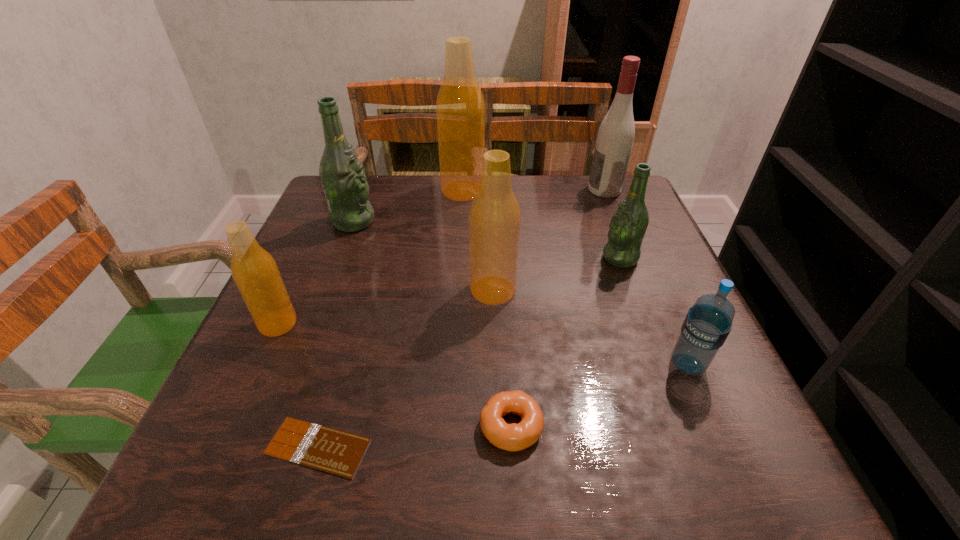
At what (x,y) coordinates should I click in order to perform the action: click on the tallest beer bottle. Please return your answer as a coordinate pair (x, y). The image size is (960, 540). Looking at the image, I should click on tap(460, 108).

The width and height of the screenshot is (960, 540). I want to click on the farthest beer bottle, so click(x=460, y=108).

This screenshot has height=540, width=960. I want to click on alcohol, so click(615, 137).

The height and width of the screenshot is (540, 960). Find the location of `the bigger green beer bottle`. the bigger green beer bottle is located at coordinates (342, 175).

Where is `the left green beer bottle`? the left green beer bottle is located at coordinates (342, 175).

At what (x,y) coordinates should I click in order to perform the action: click on the fourth farthest beer bottle. Please return your answer as a coordinate pair (x, y). This screenshot has height=540, width=960. Looking at the image, I should click on (494, 217).

Image resolution: width=960 pixels, height=540 pixels. What are the coordinates of `the second farthest tan beer bottle` in the screenshot? It's located at (494, 217).

Where is `the fourth nearest object`? This screenshot has width=960, height=540. the fourth nearest object is located at coordinates (255, 272).

Where is `the smallest tan beer bottle`? the smallest tan beer bottle is located at coordinates (255, 272).

I want to click on the sixth nearest object, so click(628, 225).